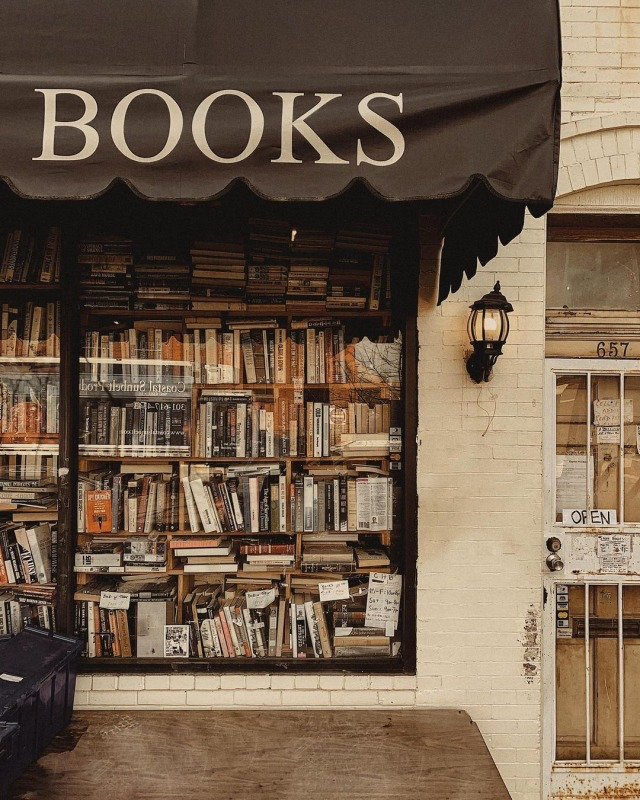
This screenshot has height=800, width=640. What are the coordinates of `rows of books` in the screenshot? It's located at (200, 297), (221, 344), (249, 428), (242, 506), (240, 606).